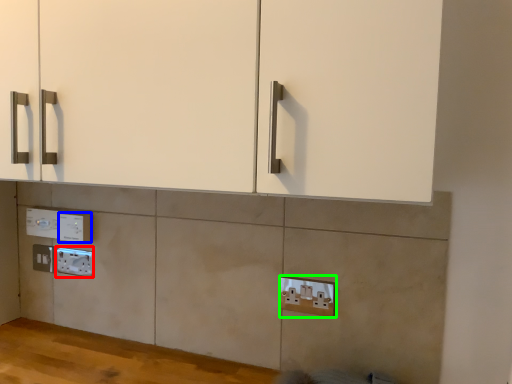
Question: Which object is positioned farthest from electric outlet (highlighted by a red box)? Select from electric outlet (highlighted by a blue box) and electric outlet (highlighted by a green box).

Choices:
 (A) electric outlet
 (B) electric outlet

Answer: (B)